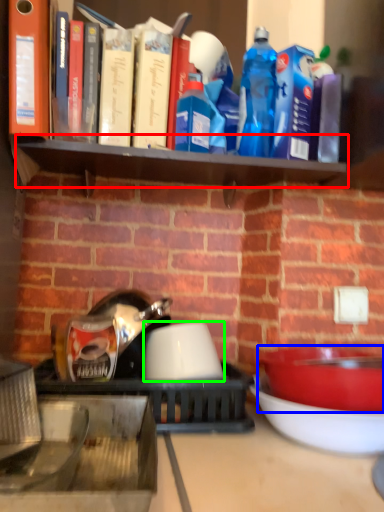
Question: Which is farther away from shelf (highlighted by a red box)? bowl (highlighted by a blue box) or bowl (highlighted by a green box)?

Choices:
 (A) bowl
 (B) bowl

Answer: (A)